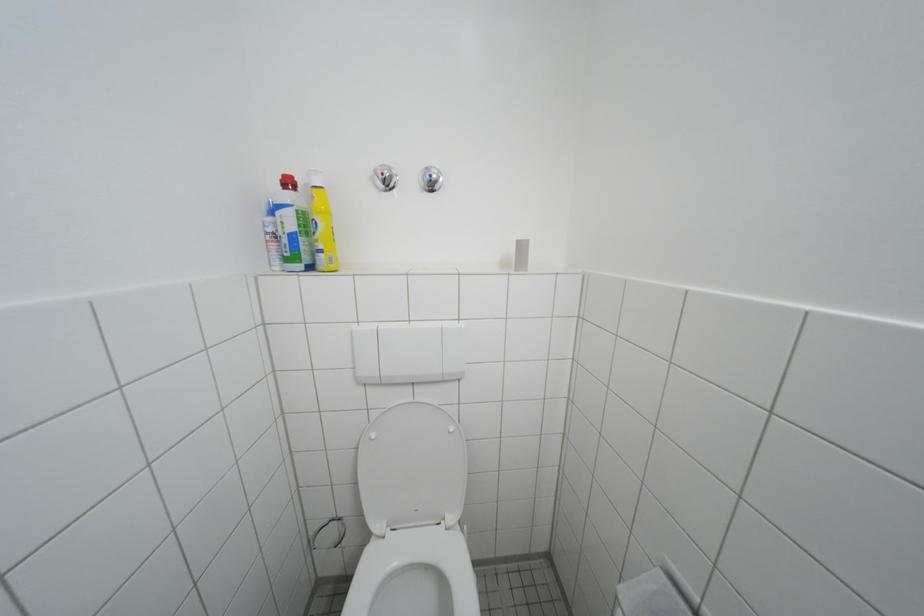
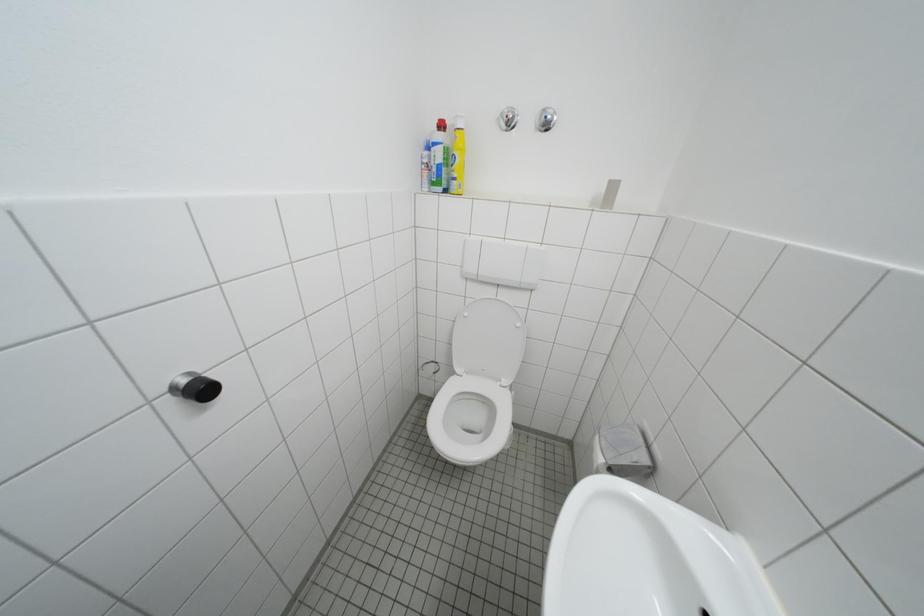
Question: How did the camera likely rotate?

Choices:
 (A) Left
 (B) Right
 (C) Up
 (D) Down

Answer: (A)